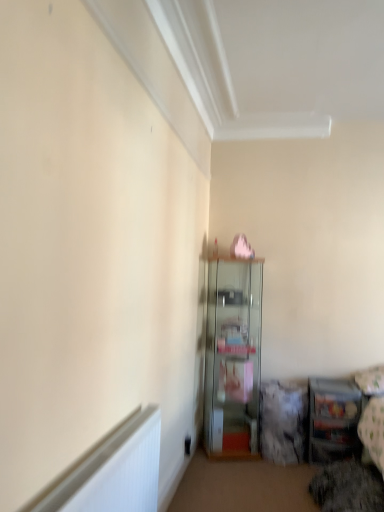
Question: Is metallic glass shelf at lower right, which ranks as the 2th shelf in left-to-right order, spatially inside clear glass cabinet at center, the 2th shelf in the right-to-left sequence, or outside of it?

Choices:
 (A) inside
 (B) outside

Answer: (B)

Question: From the image's perspective, is metallic glass shelf at lower right, which ranks as the 2th shelf in left-to-right order, located above or below clear glass cabinet at center, which is counted as the 1th shelf, starting from the left?

Choices:
 (A) below
 (B) above

Answer: (A)

Question: Considering the positions of metallic glass shelf at lower right, which appears as the 1th shelf when viewed from the right, and clear glass cabinet at center, the 2th shelf in the right-to-left sequence, in the image, is metallic glass shelf at lower right, which appears as the 1th shelf when viewed from the right, taller or shorter than clear glass cabinet at center, the 2th shelf in the right-to-left sequence,?

Choices:
 (A) short
 (B) tall

Answer: (A)

Question: Considering their positions, is clear glass cabinet at center, the 2th shelf in the right-to-left sequence, located in front of or behind metallic glass shelf at lower right, which ranks as the 2th shelf in left-to-right order?

Choices:
 (A) behind
 (B) front

Answer: (A)

Question: Is clear glass cabinet at center, the 2th shelf in the right-to-left sequence, taller or shorter than metallic glass shelf at lower right, which appears as the 1th shelf when viewed from the right?

Choices:
 (A) tall
 (B) short

Answer: (A)

Question: Would you say clear glass cabinet at center, which is counted as the 1th shelf, starting from the left, is to the left or to the right of metallic glass shelf at lower right, which appears as the 1th shelf when viewed from the right, in the picture?

Choices:
 (A) left
 (B) right

Answer: (A)

Question: From a real-world perspective, relative to metallic glass shelf at lower right, which appears as the 1th shelf when viewed from the right, is clear glass cabinet at center, which is counted as the 1th shelf, starting from the left, vertically above or below?

Choices:
 (A) above
 (B) below

Answer: (A)